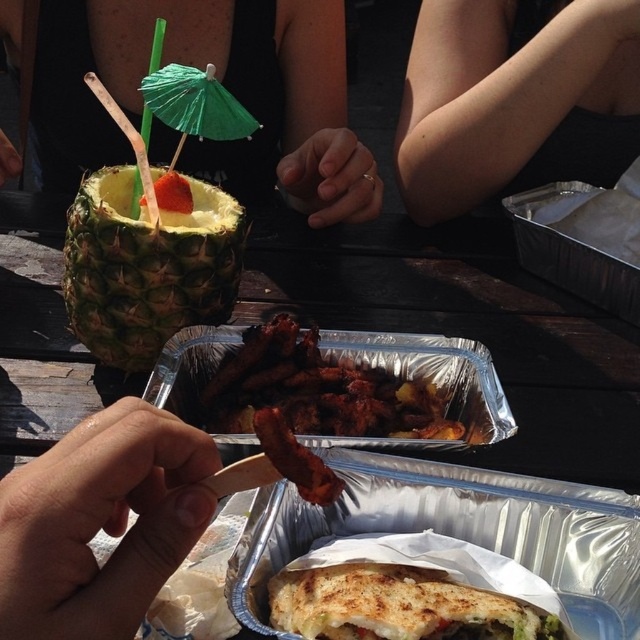
You are a food safety inspector checking the barbecue setup. There is a point labeled at coordinates (515, 99) indicating a skinny arm at upper center. Based on the scene described, where is the hand holding the skewer in relation to this point?

The hand holding the skewer is below the point labeled at coordinates (515, 99) indicating a skinny arm at upper center, as the arm is at upper center and the skewer is in the foreground.

You are holding a skewer with grilled meat over two aluminum foil trays. The skewer is at point (161, 278). The nearest tray is 16.39 inches away from the skewer. Can you safely place the skewer on the nearest tray without dripping sauce on the other tray?

The skewer at point (161, 278) is 16.39 inches away from the nearest tray. Since the nearest tray is closer, you can safely place the skewer on it without dripping sauce on the other tray.

You are at a barbecue party and need to place a green paper umbrella at upper left into a drink. The golden crispy sandwich at center is in the way. Can you move the umbrella without moving the sandwich?

The golden crispy sandwich at center is 11.05 inches away from the green paper umbrella at upper left, so you can move the umbrella without disturbing the sandwich as they are sufficiently spaced apart.